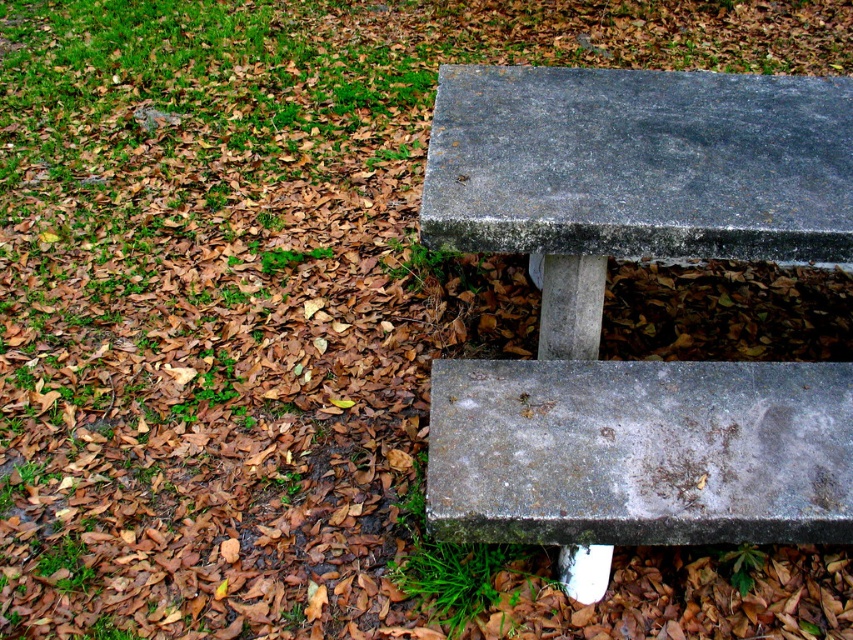
Who is taller, gray concrete bench at upper center or gray concrete bench at lower right?

gray concrete bench at upper center is taller.

Locate an element on the screen. The height and width of the screenshot is (640, 853). gray concrete bench at upper center is located at coordinates (639, 163).

What do you see at coordinates (639, 163) in the screenshot?
I see `gray concrete bench at upper center` at bounding box center [639, 163].

Image resolution: width=853 pixels, height=640 pixels. Identify the location of gray concrete bench at upper center. (639, 163).

Is point (669, 403) positioned behind point (492, 243)?

Yes.

Can you confirm if gray concrete bench at center is positioned below gray concrete bench at upper center?

Yes, gray concrete bench at center is below gray concrete bench at upper center.

The width and height of the screenshot is (853, 640). What do you see at coordinates (602, 301) in the screenshot?
I see `gray concrete bench at center` at bounding box center [602, 301].

Locate an element on the screen. This screenshot has width=853, height=640. gray concrete bench at center is located at coordinates (602, 301).

Which of these two, gray concrete bench at center or gray concrete bench at lower right, stands shorter?

Standing shorter between the two is gray concrete bench at lower right.

Who is more distant from viewer, (543, 484) or (451, 452)?

The point (451, 452) is behind.

Which is in front, point (579, 346) or point (579, 454)?

Point (579, 454) is in front.

Where is `gray concrete bench at center`? This screenshot has height=640, width=853. gray concrete bench at center is located at coordinates (602, 301).